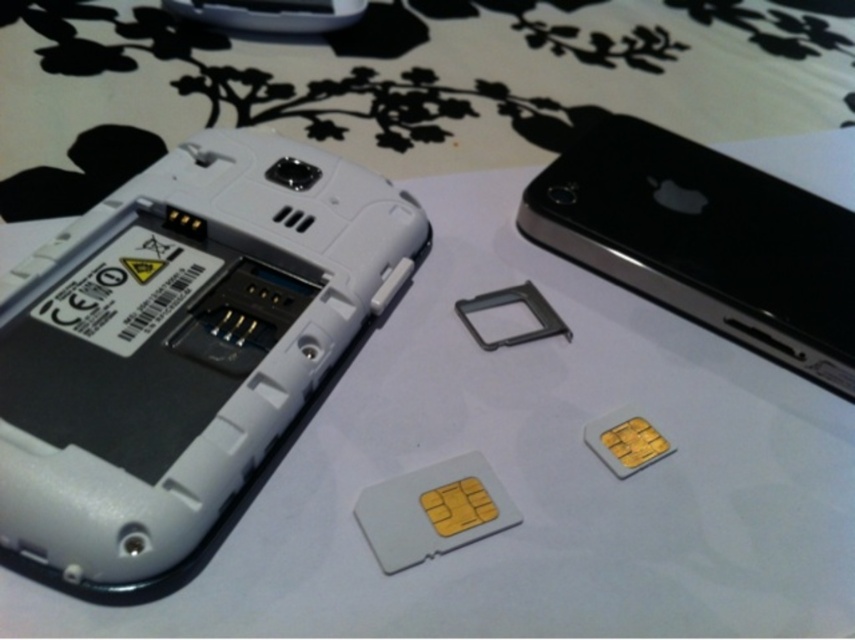
Consider the image. You are trying to place both smartphones on a shelf that can only hold one smartphone at a time. Since the white plastic smartphone at upper left is on the left of the black glossy smartphone at upper right, which smartphone should you move first to ensure only one stays?

You should move the black glossy smartphone at upper right first because the white plastic smartphone at upper left is positioned to the left of it, meaning the black glossy smartphone is closer to the right side and can be removed without disturbing the other.

You are trying to determine which smartphone has a larger screen. You see a white plastic smartphone at upper left and a black glossy smartphone at upper right. Based on their overall sizes, which one likely has a larger screen?

The white plastic smartphone at upper left is larger in size than the black glossy smartphone at upper right, so it likely has a larger screen.

You are holding a small tool that is 3 centimeters long. You need to reach the black glossy smartphone at upper right to fix it. Is the white plastic smartphone at upper left in the way?

The white plastic smartphone at upper left is closer to the viewer than black glossy smartphone at upper right, so it may block access to the black glossy smartphone at upper right. You might need to move the white plastic smartphone at upper left out of the way first.